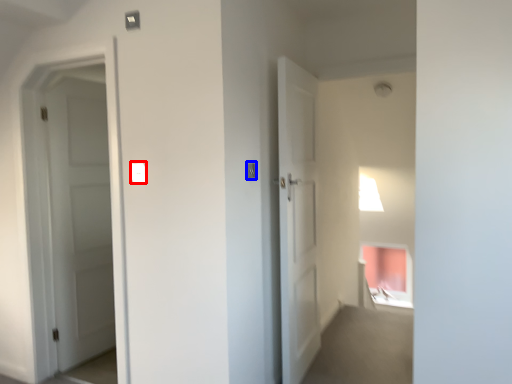
Question: Which point is further to the camera, light switch (highlighted by a red box) or light switch (highlighted by a blue box)?

Choices:
 (A) light switch
 (B) light switch

Answer: (B)